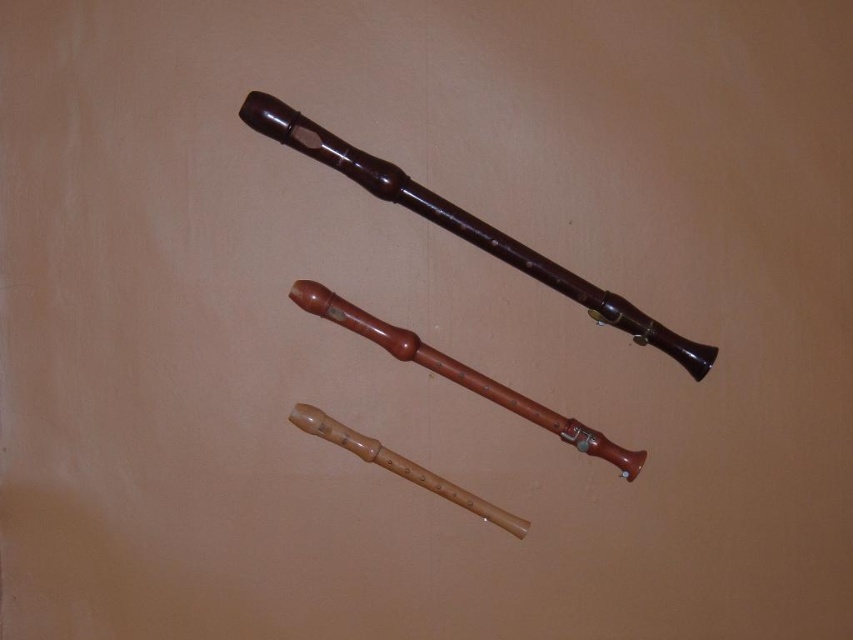
You are an interior designer arranging items on a shelf. You have a matte brown flute at upper center. Where should you place it so that it aligns with the coordinates provided in the scene?

The matte brown flute at upper center should be placed at point (465, 227) to align with the coordinates provided in the scene.

You are standing in front of the three wooden flutes displayed diagonally against a plain, light brown background. You want to reach out and touch the point at coordinates point (x=368, y=188). Considering your arm is 0.7 meters long, can you comfortably reach that point without moving your feet?

The point (x=368, y=188) is 1.31 meters from the camera. Since your arm is only 0.7 meters long, you cannot comfortably reach the point at point (x=368, y=188) without moving your feet.

You are an archer standing at the point marked as point (x=460, y=372). You want to shoot an arrow towards the largest wooden flute. Which direction should you aim relative to your current position?

The light brown wood flute at center is located at point (x=460, y=372). Since the largest flute is positioned at the top right, you should aim towards the top right direction from your current position.